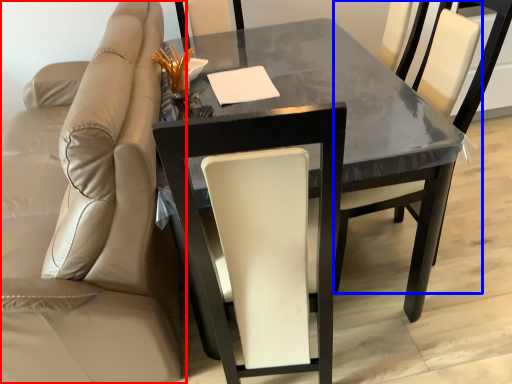
Question: Which point is further to the camera, chair (highlighted by a red box) or chair (highlighted by a blue box)?

Choices:
 (A) chair
 (B) chair

Answer: (B)